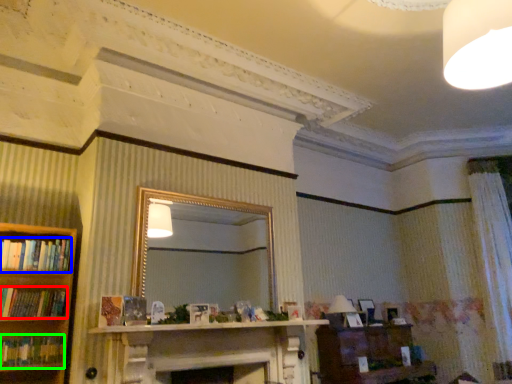
Question: Which is nearer to the book (highlighted by a red box)? book (highlighted by a blue box) or book (highlighted by a green box).

Choices:
 (A) book
 (B) book

Answer: (B)